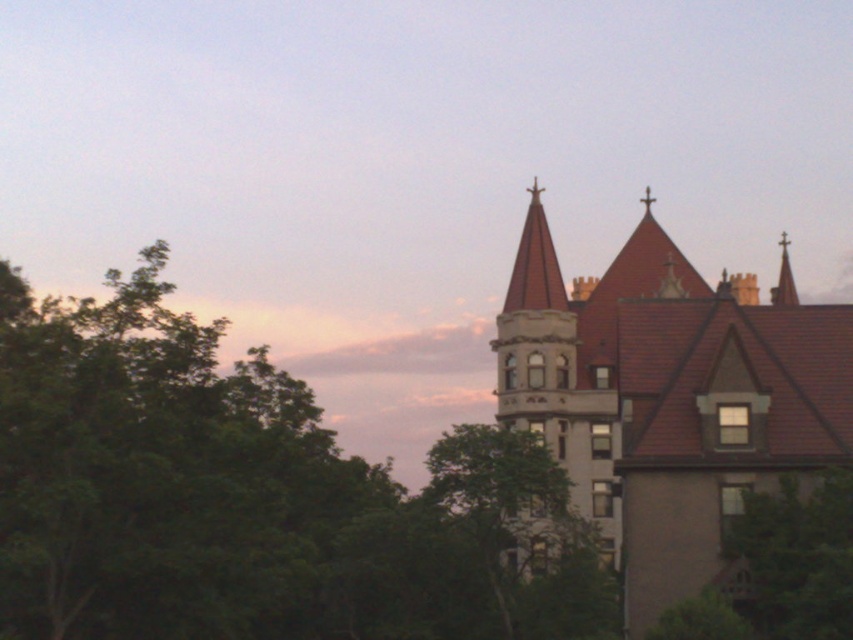
You are planning to install a bench in the garden area near the building. The bench needs to be placed where there is enough space between the green leafy tree at upper left and the green leafy tree at lower right. Which tree has a wider canopy to consider for spacing?

The green leafy tree at upper left has a larger width than the green leafy tree at lower right, so you should consider the space around the green leafy tree at upper left for placing the bench to ensure adequate spacing.

You are standing in front of the large building and want to take a photo that includes both the green leafy tree at upper left and the white stone tower at center. Which object should you position closer to the left side of your camera frame?

The green leafy tree at upper left should be positioned closer to the left side of your camera frame because it is already located to the left of the white stone tower at center.

Looking at this image, you are a landscape architect reviewing the image of the building. You need to determine which tree, the green leafy tree at upper left or the green leafy tree at lower right, requires more space for growth. Based on the image, which tree would you prioritize for pruning to prevent obstruction of the building view?

The green leafy tree at upper left is larger in size than the green leafy tree at lower right, so it would require more space for growth and should be prioritized for pruning to prevent obstruction of the building view.